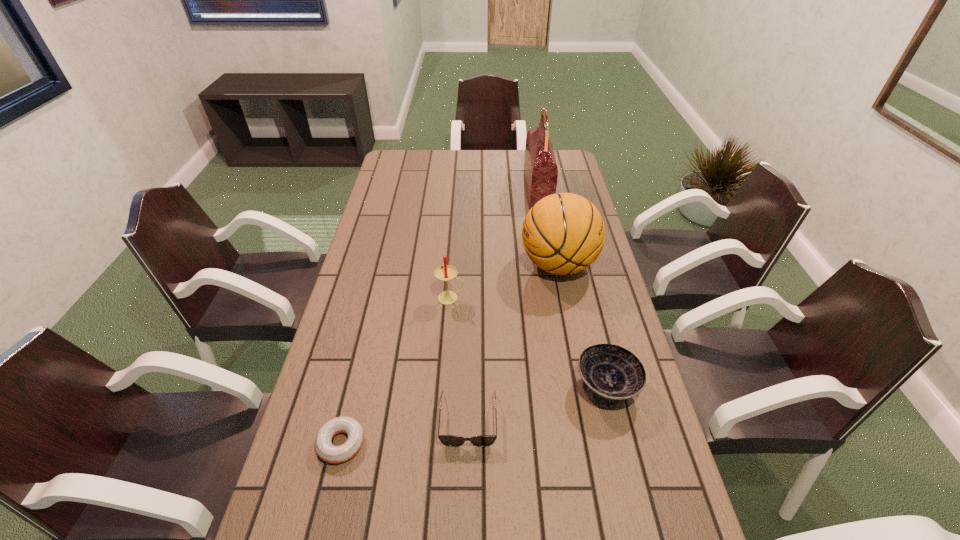
Where is `free space that is in between the second tallest object and the second shortest object`? This screenshot has width=960, height=540. free space that is in between the second tallest object and the second shortest object is located at coordinates (514, 342).

This screenshot has width=960, height=540. In order to click on vacant region between the fourth tallest object and the handbag in this screenshot , I will do `click(572, 288)`.

At what (x,y) coordinates should I click in order to perform the action: click on free space between the sunglasses and the leftmost object. Please return your answer as a coordinate pair (x, y). The image size is (960, 540). Looking at the image, I should click on (405, 431).

Identify the location of free space between the fifth tallest object and the shortest object. The image size is (960, 540). (405, 431).

This screenshot has height=540, width=960. I want to click on vacant area that lies between the bowl and the sunglasses, so click(538, 403).

Locate an element on the screen. unoccupied position between the sunglasses and the handbag is located at coordinates (503, 305).

This screenshot has width=960, height=540. I want to click on free space that is in between the handbag and the sunglasses, so click(503, 305).

Locate which object ranks third in proximity to the fifth tallest object. Please provide its 2D coordinates. Your answer should be formatted as a tuple, i.e. [(x, y)], where the tuple contains the x and y coordinates of a point satisfying the conditions above.

[(446, 273)]

You are a GUI agent. You are given a task and a screenshot of the screen. Output one action in this format:
    pyautogui.click(x=<x>, y=<y>)
    Task: Click on the object that can be found as the second closest to the doughnut
    
    Given the screenshot: What is the action you would take?
    pyautogui.click(x=446, y=273)

You are a GUI agent. You are given a task and a screenshot of the screen. Output one action in this format:
    pyautogui.click(x=<x>, y=<y>)
    Task: Click on the vacant space that satisfies the following two spatial constraints: 1. on the front-facing side of the handbag; 2. at the front lenses of the second shortest object
    This screenshot has height=540, width=960.
    Given the screenshot: What is the action you would take?
    tap(579, 419)